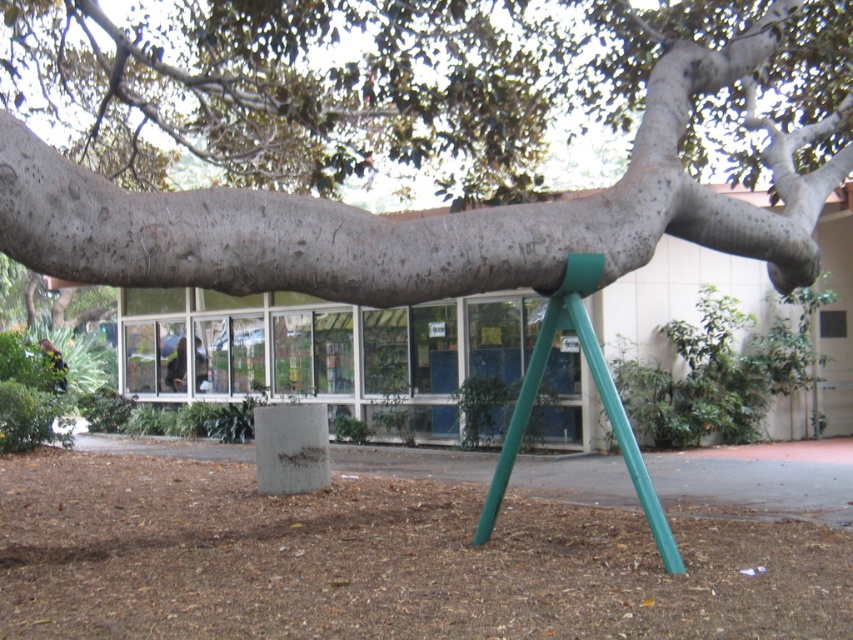
You are a painter trying to capture the scene of the large tree trunk supported by a modern green metal tripod. You need to decide which object to focus on first based on their sizes. According to the scene, which object should you paint first, the smooth gray bark at center or the green matte tripod at center?

The smooth gray bark at center is bigger than the green matte tripod at center, so you should paint the smooth gray bark at center first as it is larger and likely the main subject.

You are standing in front of the tree and want to touch both the smooth gray bark at center and the green matte tripod at center. Which object will you need to reach out further to touch?

You will need to reach out further to touch the green matte tripod at center because it is farther away from you than the smooth gray bark at center.